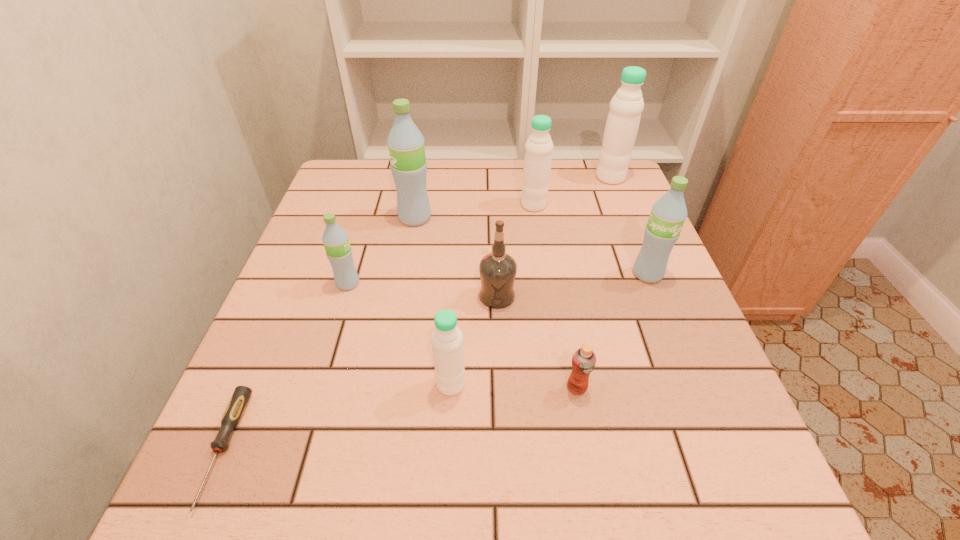
Locate an element on the screen. This screenshot has height=540, width=960. free space located on the front label of the fifth object from right to left is located at coordinates (426, 295).

This screenshot has height=540, width=960. Find the location of `free spot located on the front label of the fifth object from right to left`. free spot located on the front label of the fifth object from right to left is located at coordinates (441, 295).

The height and width of the screenshot is (540, 960). What are the coordinates of `free space located on the left of the smallest green water bottle` in the screenshot? It's located at (295, 284).

Image resolution: width=960 pixels, height=540 pixels. What are the coordinates of `free location located 0.170m on the left of the smallest white water bottle` in the screenshot? It's located at (340, 384).

Where is `vacant space located on the back of the eighth tallest object`? vacant space located on the back of the eighth tallest object is located at coordinates (561, 296).

Identify the location of object present at the near edge. Image resolution: width=960 pixels, height=540 pixels. (237, 404).

Locate an element on the screen. This screenshot has height=540, width=960. water bottle that is positioned at the left edge is located at coordinates (335, 239).

I want to click on screwdriver that is at the left edge, so click(x=237, y=404).

Find the location of a particular element. This screenshot has width=960, height=540. object at the near left corner is located at coordinates (237, 404).

Locate an element on the screen. The height and width of the screenshot is (540, 960). object situated at the far right corner is located at coordinates (626, 106).